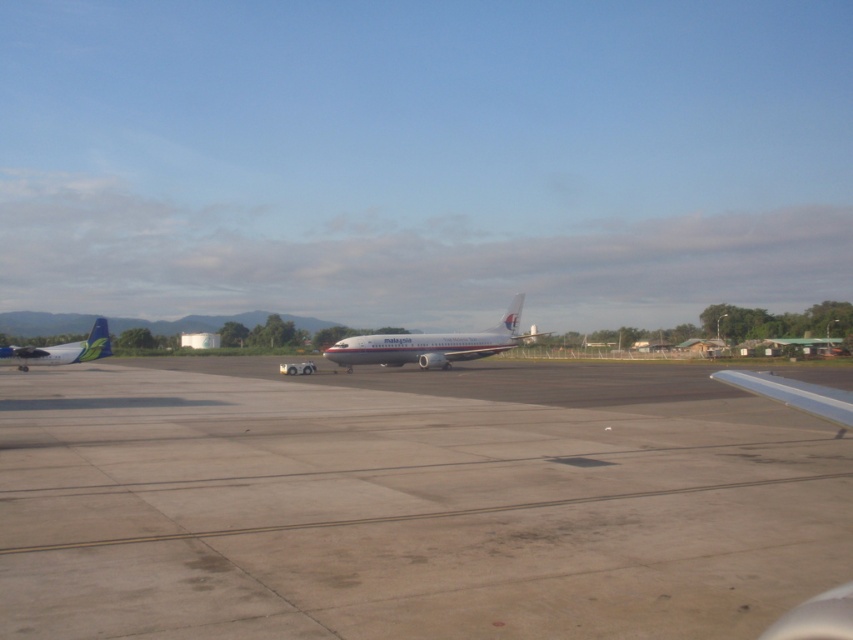
Based on the photo, you are a passenger seated at the window seat of the Malaysia Airlines aircraft. You notice two points marked on the tarmac outside your window. The first point is at coordinates point(x=498, y=349) and the second is at point(x=91, y=339). Which point is closer to your seat?

Point(x=498, y=349) is closer to your seat because it is further to the viewer than point(x=91, y=339).

You are a flight attendant on the white metallic airplane at center. You notice the matte white airplane at left through the window. Based on your current position, which airplane is closer to the ground?

The matte white airplane at left is closer to the ground because the white metallic airplane at center is located above it.

You are a pilot preparing for takeoff and need to ensure the runway is clear. From your current position inside the cockpit, which object is closer to you, the gray concrete runway at center or the matte white airplane at left?

The matte white airplane at left is closer to you because the gray concrete runway at center is positioned to the right of it, meaning the runway is further away in this arrangement.